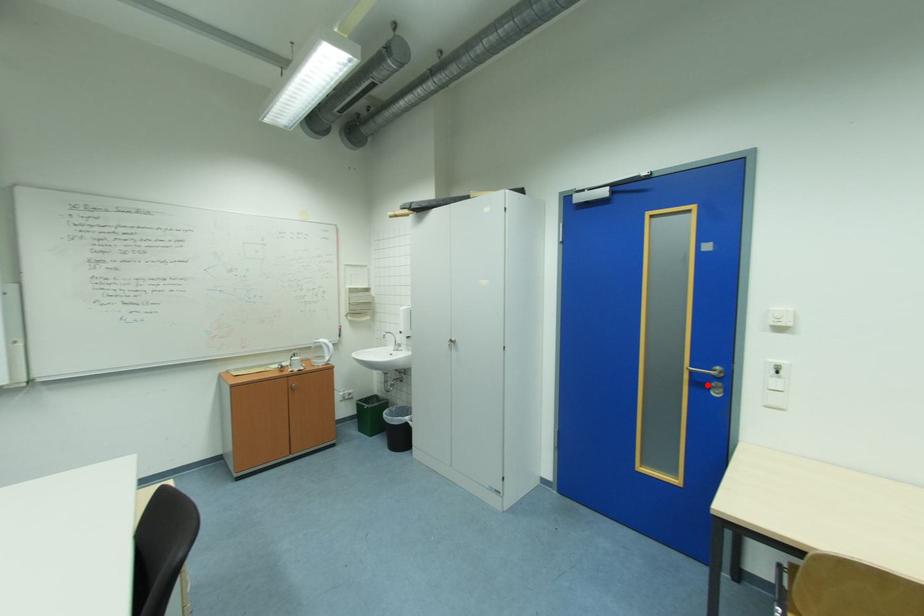
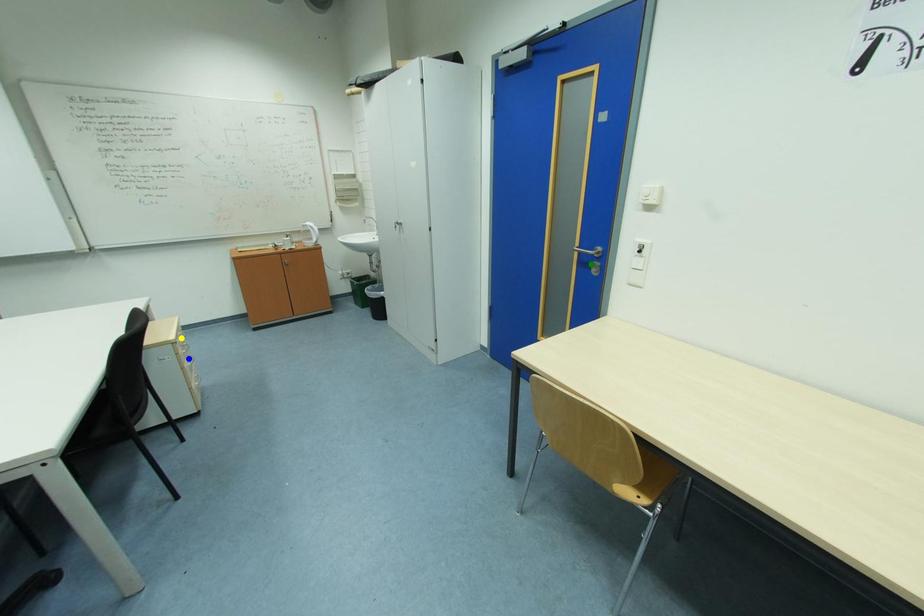
Question: I am providing you with two images of the same scene from different viewpoints. A red point is marked on the first image. You are given multiple points on the second image. Which point in image 2 represents the same 3d spot as the red point in image 1?

Choices:
 (A) green point
 (B) blue point
 (C) yellow point

Answer: (A)